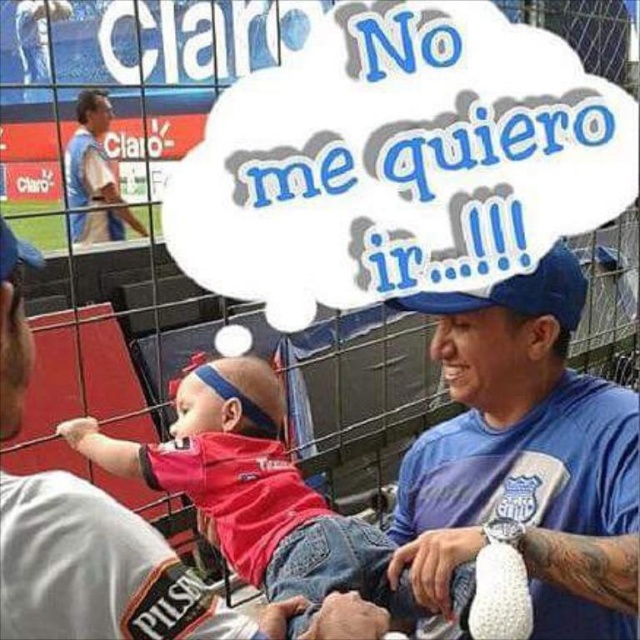
Who is lower down, matte red shirt at center or matte blue shirt at upper left?

matte red shirt at center is lower down.

Between point (365, 579) and point (100, 150), which one is positioned behind?

Positioned behind is point (100, 150).

The height and width of the screenshot is (640, 640). In order to click on matte red shirt at center in this screenshot , I will do `click(253, 490)`.

Can you confirm if blue fabric shirt at center is shorter than matte red shirt at center?

In fact, blue fabric shirt at center may be taller than matte red shirt at center.

Can you confirm if blue fabric shirt at center is positioned to the left of matte red shirt at center?

No, blue fabric shirt at center is not to the left of matte red shirt at center.

Does point (573, 596) come behind point (305, 573)?

No, it is not.

This screenshot has width=640, height=640. Identify the location of blue fabric shirt at center. (525, 456).

Between point (513, 440) and point (88, 156), which one is positioned in front?

Positioned in front is point (513, 440).

Between point (438, 346) and point (74, 161), which one is positioned behind?

Positioned behind is point (74, 161).

Locate an element on the screen. This screenshot has height=640, width=640. blue fabric shirt at center is located at coordinates (525, 456).